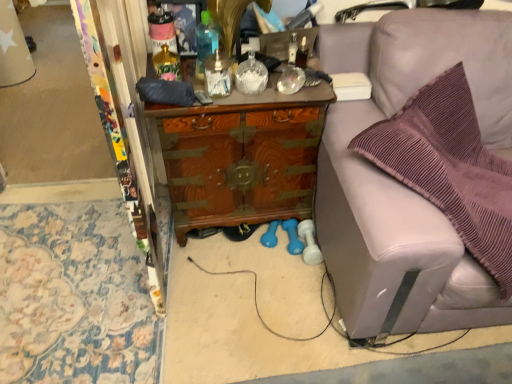
Measure the distance between point (200, 93) and camera.

4.48 feet.

Measure the distance between black matte remote control at center and camera.

black matte remote control at center is 4.45 feet away from camera.

Measure the distance between point (157, 61) and camera.

The distance of point (157, 61) from camera is 1.44 meters.

What do you see at coordinates (205, 41) in the screenshot?
I see `translucent blue bottle at center, the third bottle when ordered from left to right` at bounding box center [205, 41].

The image size is (512, 384). I want to click on black matte remote control at center, so click(x=203, y=97).

From the picture: Would you consider clear glass soap dispenser at center, positioned as the 4th bottle in left-to-right order, to be distant from translucent glass vase at center, placed as the 4th bottle when sorted from right to left?

They are positioned close to each other.

From a real-world perspective, is clear glass soap dispenser at center, the 2th bottle from the right, physically located above or below translucent glass vase at center, placed as the 4th bottle when sorted from right to left?

clear glass soap dispenser at center, the 2th bottle from the right, is above translucent glass vase at center, placed as the 4th bottle when sorted from right to left.

Is clear glass soap dispenser at center, positioned as the 4th bottle in left-to-right order, turned away from translucent glass vase at center, the second bottle from the left?

clear glass soap dispenser at center, positioned as the 4th bottle in left-to-right order, does not have its back to translucent glass vase at center, the second bottle from the left.

Considering the relative sizes of clear glass soap dispenser at center, positioned as the 4th bottle in left-to-right order, and translucent glass vase at center, placed as the 4th bottle when sorted from right to left, in the image provided, is clear glass soap dispenser at center, positioned as the 4th bottle in left-to-right order, shorter than translucent glass vase at center, placed as the 4th bottle when sorted from right to left,?

Incorrect, the height of clear glass soap dispenser at center, positioned as the 4th bottle in left-to-right order, does not fall short of that of translucent glass vase at center, placed as the 4th bottle when sorted from right to left.

Which object is wider, wooden chest at center or purple fabric chair at right?

With larger width is wooden chest at center.

Is wooden chest at center bigger than purple fabric chair at right?

No.

Is purple fabric chair at right a part of wooden chest at center?

Definitely not — purple fabric chair at right is not inside wooden chest at center.

Which object is closer to the camera, wooden chest at center or purple fabric chair at right?

purple fabric chair at right is more forward.

Considering the relative sizes of black matte remote control at center and purple fabric chair at right in the image provided, is black matte remote control at center smaller than purple fabric chair at right?

Yes.

Would you consider black matte remote control at center to be distant from purple fabric chair at right?

That's not correct — black matte remote control at center is a little close to purple fabric chair at right.

Which object is closer to the camera taking this photo, black matte remote control at center or purple fabric chair at right?

purple fabric chair at right is in front.

Can you confirm if black matte remote control at center is taller than purple fabric chair at right?

No, black matte remote control at center is not taller than purple fabric chair at right.

Does clear glass soap dispenser at center, positioned as the 4th bottle in left-to-right order, have a greater height compared to clear glass jar at center, which is the 5th bottle in left-to-right order?

Yes, clear glass soap dispenser at center, positioned as the 4th bottle in left-to-right order, is taller than clear glass jar at center, which is the 5th bottle in left-to-right order.

Would you say clear glass soap dispenser at center, positioned as the 4th bottle in left-to-right order, contains clear glass jar at center, which appears as the 1th bottle when viewed from the right?

No, clear glass soap dispenser at center, positioned as the 4th bottle in left-to-right order, does not contain clear glass jar at center, which appears as the 1th bottle when viewed from the right.

Is clear glass soap dispenser at center, positioned as the 4th bottle in left-to-right order, touching clear glass jar at center, which is the 5th bottle in left-to-right order?

Yes, clear glass soap dispenser at center, positioned as the 4th bottle in left-to-right order, is right next to clear glass jar at center, which is the 5th bottle in left-to-right order, and making contact.

From the image's perspective, would you say clear glass soap dispenser at center, positioned as the 4th bottle in left-to-right order, is positioned over clear glass jar at center, which appears as the 1th bottle when viewed from the right?

Yes, from the image's perspective, clear glass soap dispenser at center, positioned as the 4th bottle in left-to-right order, is above clear glass jar at center, which appears as the 1th bottle when viewed from the right.

From the picture: Is matte pink plastic bottle at upper center, marked as the fifth bottle in a right-to-left arrangement, at the right side of translucent blue bottle at center, placed as the 3th bottle when sorted from right to left?

No, matte pink plastic bottle at upper center, marked as the fifth bottle in a right-to-left arrangement, is not to the right of translucent blue bottle at center, placed as the 3th bottle when sorted from right to left.

Is matte pink plastic bottle at upper center, marked as the fifth bottle in a right-to-left arrangement, turned away from translucent blue bottle at center, placed as the 3th bottle when sorted from right to left?

No, translucent blue bottle at center, placed as the 3th bottle when sorted from right to left, is not at the back of matte pink plastic bottle at upper center, marked as the fifth bottle in a right-to-left arrangement.

From the wooden chest at center, count 5th bottles forward and point to it. Please provide its 2D coordinates.

[(218, 74)]

Can you confirm if clear glass soap dispenser at center, positioned as the 4th bottle in left-to-right order, is positioned to the left of wooden chest at center?

Yes.

Can you confirm if clear glass soap dispenser at center, the 2th bottle from the right, is shorter than wooden chest at center?

Correct, clear glass soap dispenser at center, the 2th bottle from the right, is not as tall as wooden chest at center.

From the image's perspective, is clear glass soap dispenser at center, positioned as the 4th bottle in left-to-right order, below wooden chest at center?

Actually, clear glass soap dispenser at center, positioned as the 4th bottle in left-to-right order, appears above wooden chest at center in the image.

Is point (175, 44) positioned after point (222, 67)?

Yes.

From the image's perspective, which one is positioned higher, matte pink plastic bottle at upper center, marked as the fifth bottle in a right-to-left arrangement, or clear glass soap dispenser at center, positioned as the 4th bottle in left-to-right order?

matte pink plastic bottle at upper center, marked as the fifth bottle in a right-to-left arrangement, appears higher in the image.

Is matte pink plastic bottle at upper center, marked as the fifth bottle in a right-to-left arrangement, smaller than clear glass soap dispenser at center, positioned as the 4th bottle in left-to-right order?

Yes.

From a real-world perspective, count 1st bottles downward from the clear glass soap dispenser at center, positioned as the 4th bottle in left-to-right order, and point to it. Please provide its 2D coordinates.

[(167, 65)]

Find the location of `chair in front of the wooden chest at center`. chair in front of the wooden chest at center is located at coordinates (399, 182).

Based on their spatial positions, is clear glass soap dispenser at center, the 2th bottle from the right, or purple fabric chair at right closer to matte pink plastic bottle at upper center, marked as the fifth bottle in a right-to-left arrangement?

clear glass soap dispenser at center, the 2th bottle from the right, is closer to matte pink plastic bottle at upper center, marked as the fifth bottle in a right-to-left arrangement.

In the scene shown: Which object lies further to the anchor point clear glass jar at center, which appears as the 1th bottle when viewed from the right, matte pink plastic bottle at upper center, the 1th bottle viewed from the left, or wooden chest at center?

The object further to clear glass jar at center, which appears as the 1th bottle when viewed from the right, is wooden chest at center.

Considering their positions, is wooden chest at center positioned further to translucent blue bottle at center, the third bottle when ordered from left to right, than purple fabric chair at right?

purple fabric chair at right.

Estimate the real-world distances between objects in this image. Which object is further from purple fabric chair at right, clear glass soap dispenser at center, the 2th bottle from the right, or clear glass jar at center, which appears as the 1th bottle when viewed from the right?

clear glass soap dispenser at center, the 2th bottle from the right.

When comparing their distances from translucent blue bottle at center, the third bottle when ordered from left to right, does black matte remote control at center or clear glass soap dispenser at center, the 2th bottle from the right, seem closer?

Based on the image, clear glass soap dispenser at center, the 2th bottle from the right, appears to be nearer to translucent blue bottle at center, the third bottle when ordered from left to right.

When comparing their distances from black matte remote control at center, does purple fabric chair at right or matte pink plastic bottle at upper center, marked as the fifth bottle in a right-to-left arrangement, seem closer?

matte pink plastic bottle at upper center, marked as the fifth bottle in a right-to-left arrangement.

From the picture: From the image, which object appears to be nearer to translucent glass vase at center, the second bottle from the left, purple fabric chair at right or black matte remote control at center?

black matte remote control at center is positioned closer to the anchor translucent glass vase at center, the second bottle from the left.

Based on their spatial positions, is purple fabric chair at right or clear glass jar at center, which is the 5th bottle in left-to-right order, further from black matte remote control at center?

purple fabric chair at right lies further to black matte remote control at center than the other object.

This screenshot has height=384, width=512. I want to click on cabinetry between black matte remote control at center and purple fabric chair at right in the horizontal direction, so click(x=241, y=158).

The width and height of the screenshot is (512, 384). I want to click on cabinetry between translucent glass vase at center, placed as the 4th bottle when sorted from right to left, and purple fabric chair at right, in the horizontal direction, so pyautogui.click(x=241, y=158).

The height and width of the screenshot is (384, 512). I want to click on cabinetry between translucent glass vase at center, the second bottle from the left, and clear glass jar at center, which is the 5th bottle in left-to-right order, from left to right, so click(x=241, y=158).

Where is `bottle between translucent glass vase at center, the second bottle from the left, and clear glass soap dispenser at center, positioned as the 4th bottle in left-to-right order`? This screenshot has height=384, width=512. bottle between translucent glass vase at center, the second bottle from the left, and clear glass soap dispenser at center, positioned as the 4th bottle in left-to-right order is located at coordinates (205, 41).